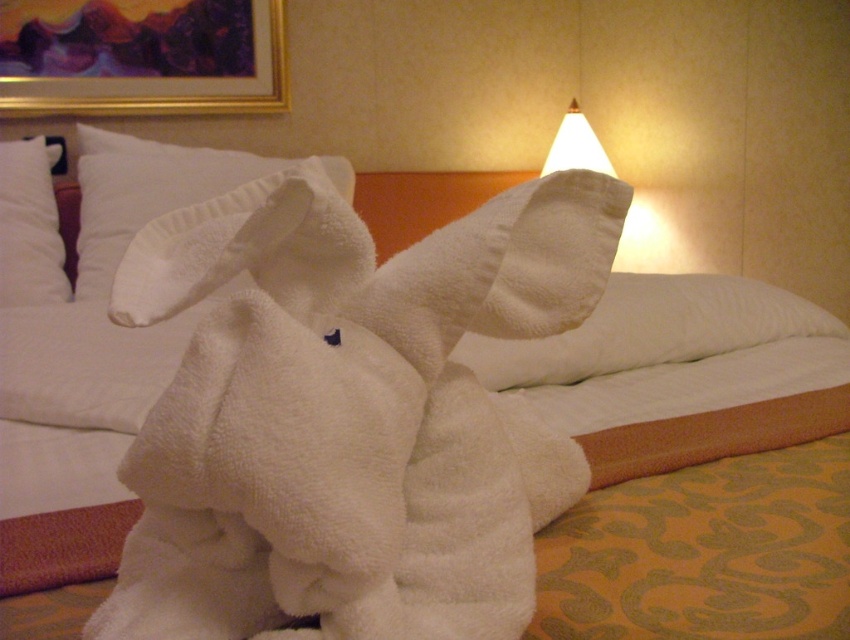
You are standing in the hotel room and want to take a photo of the white soft pillow at center. If your camera is 4.79 feet away from the pillow, is it within the recommended 5 feet focus range for clear photos?

The white soft pillow at center and camera are 4.79 feet apart from each other, so yes, it is within the recommended 5 feet focus range for clear photos.

From the picture: You are a guest in the hotel room and want to place a small book on the white soft pillow at upper left and the white paper lampshade at upper center. Which object allows you to place the book without it falling off?

The white soft pillow at upper left allows placing the book without it falling off because it has a flat surface, while the white paper lampshade at upper center is curved and might cause the book to slide off.

In the scene shown: You are a guest in the hotel room and want to use the largest pillow available. Which pillow between the white soft pillow at center and the white soft pillow at upper left should you choose?

The white soft pillow at center is larger in size than the white soft pillow at upper left, so you should choose the white soft pillow at center.